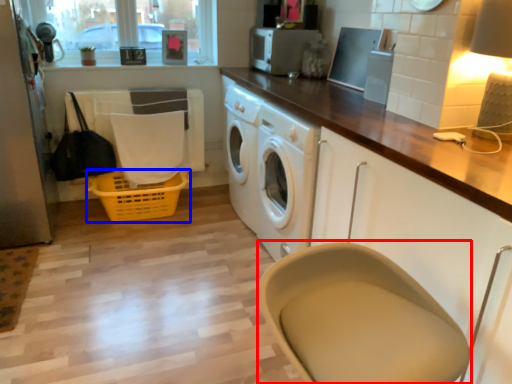
Question: Which object appears farthest to the camera in this image, feeding chair (highlighted by a red box) or basket (highlighted by a blue box)?

Choices:
 (A) feeding chair
 (B) basket

Answer: (B)